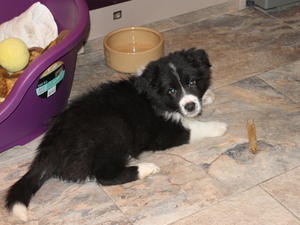
You are a GUI agent. You are given a task and a screenshot of the screen. Output one action in this format:
    pyautogui.click(x=<x>, y=<y>)
    Task: Click on the bedding
    Image resolution: width=300 pixels, height=225 pixels.
    Given the screenshot: What is the action you would take?
    pyautogui.click(x=9, y=78)